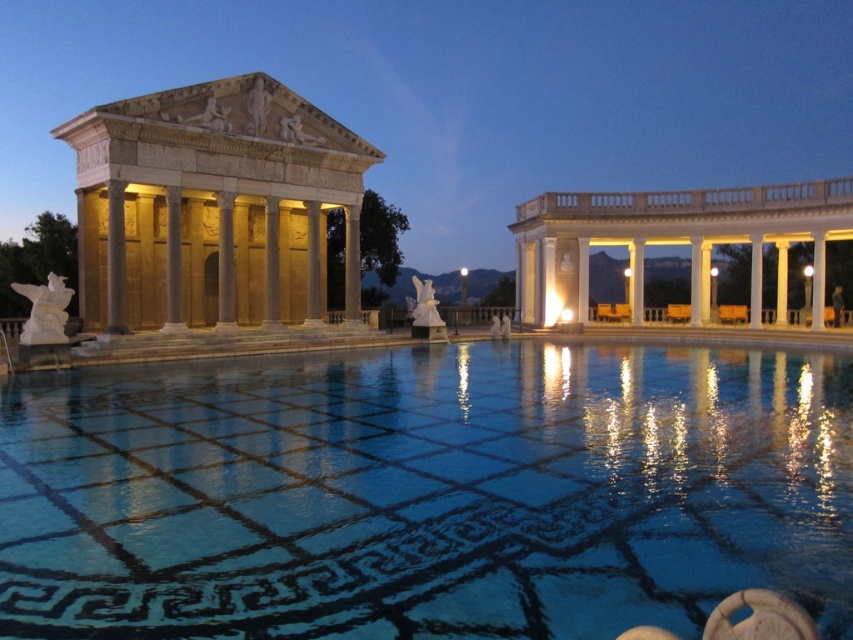
Question: Which object is positioned closest to the blue glossy water at center?

Choices:
 (A) white marble columns at right
 (B) light beige stone temple at left

Answer: (B)

Question: Which object is positioned farthest from the white marble columns at right?

Choices:
 (A) light beige stone temple at left
 (B) blue glossy water at center

Answer: (B)

Question: Is blue glossy water at center bigger than light beige stone temple at left?

Choices:
 (A) yes
 (B) no

Answer: (B)

Question: Among these points, which one is farthest from the camera?

Choices:
 (A) [x=543, y=525]
 (B) [x=811, y=208]

Answer: (B)

Question: Is blue glossy water at center smaller than white marble columns at right?

Choices:
 (A) no
 (B) yes

Answer: (B)

Question: Considering the relative positions of blue glossy water at center and light beige stone temple at left in the image provided, where is blue glossy water at center located with respect to light beige stone temple at left?

Choices:
 (A) right
 (B) left

Answer: (A)